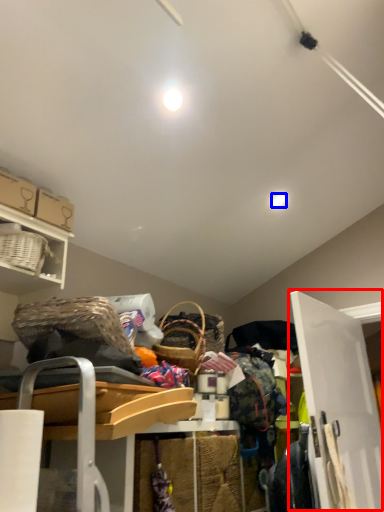
Question: Which object appears farthest to the camera in this image, door (highlighted by a red box) or light (highlighted by a blue box)?

Choices:
 (A) door
 (B) light

Answer: (B)